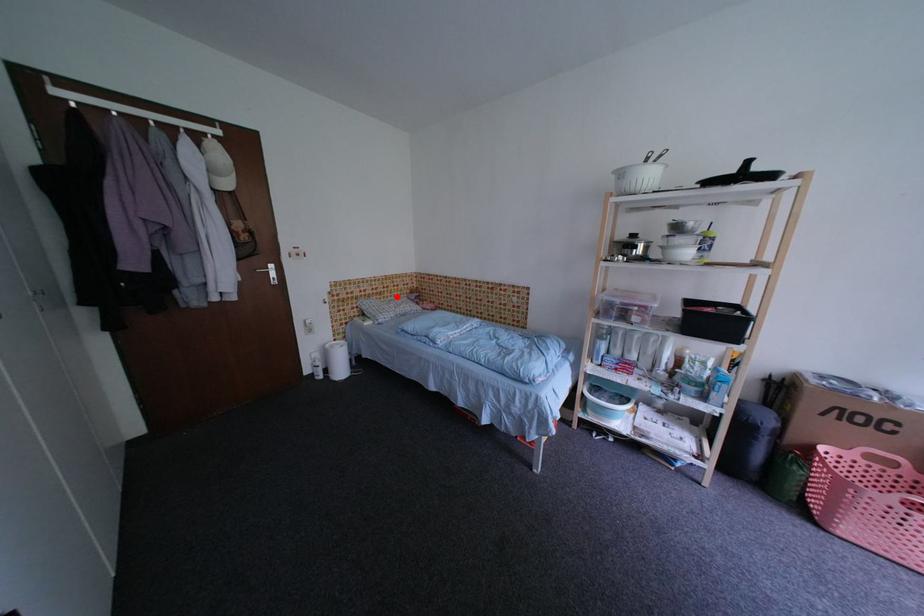
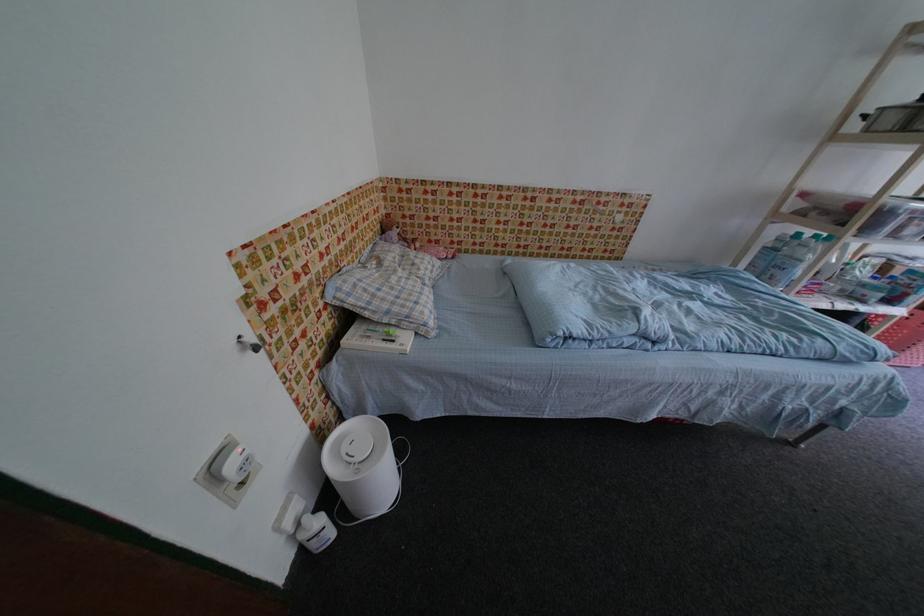
In the second image, find the point that corresponds to the highlighted location in the first image.

(370, 246)